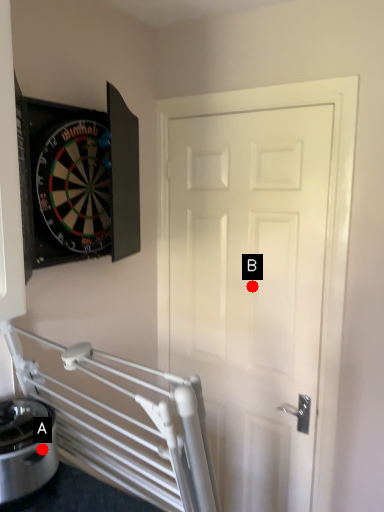
Question: Two points are circled on the image, labeled by A and B beside each circle. Among these points, which one is farthest from the camera?

Choices:
 (A) A is further
 (B) B is further

Answer: (B)